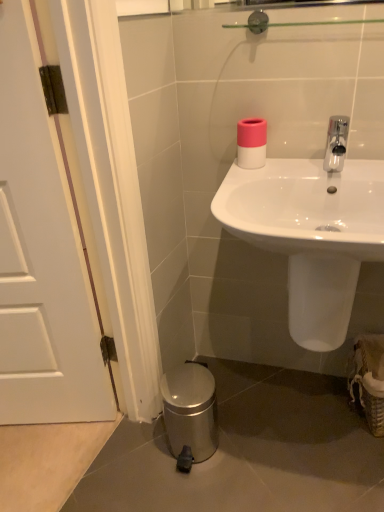
The image size is (384, 512). Find the location of `free location to the right of white matte door at left`. free location to the right of white matte door at left is located at coordinates (226, 453).